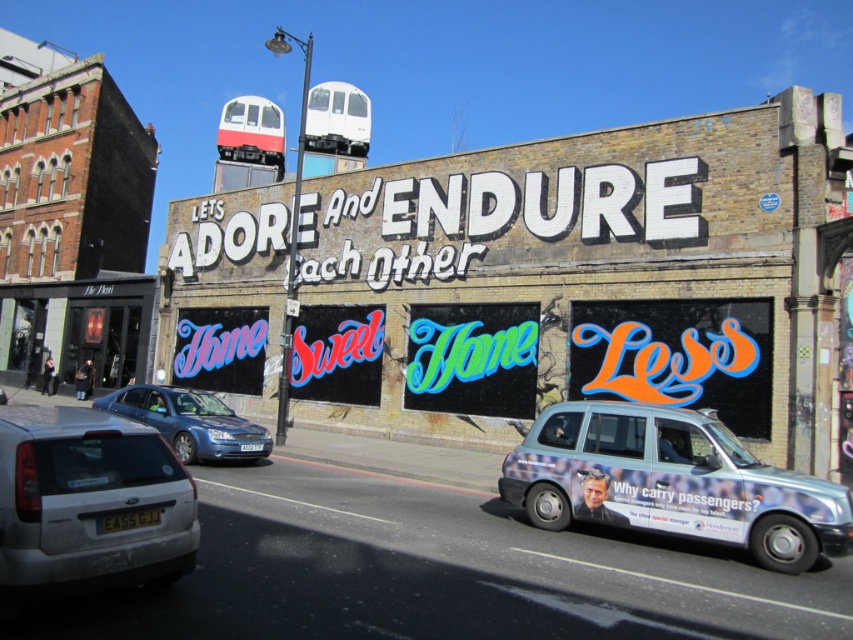
You are a photographer standing at the center of the street. You want to capture the entire graffiti wall in your photo without any obstructions. Is the silver metallic taxi at lower right blocking your view of the graffiti wall?

The silver metallic taxi at lower right is positioned at point 0.789 on the vertical axis, which is near the bottom of the image. Since the graffiti wall is the main subject occupying the upper portion of the image, the taxi is unlikely to obstruct the view of the wall. Therefore, you can capture the entire graffiti wall without obstructions from the silver metallic taxi at lower right.

You are a pedestrian standing at the edge of the street. You see a silver metallic hatchback at lower left and a blue metallic sedan at center. Which vehicle is closer to you?

The silver metallic hatchback at lower left is closer to you because it is in front of the blue metallic sedan at center.